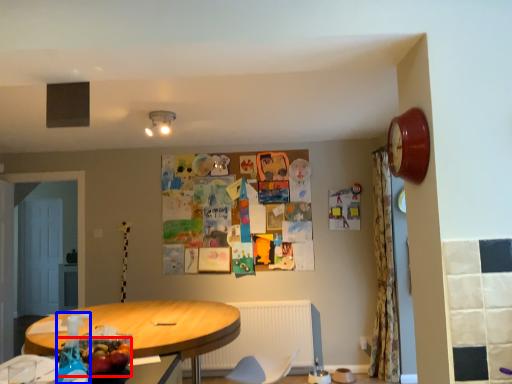
Question: Which object is closer to the camera taking this photo, food (highlighted by a red box) or bottle (highlighted by a blue box)?

Choices:
 (A) food
 (B) bottle

Answer: (B)